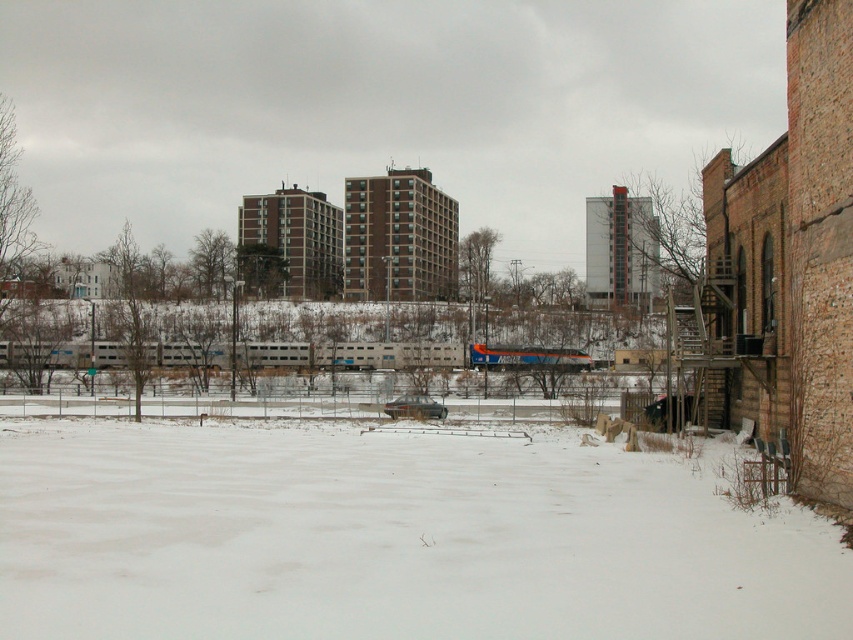
Question: Does white powdery snow at lower center appear under orange metallic train at center?

Choices:
 (A) no
 (B) yes

Answer: (B)

Question: Is silver metallic train at center thinner than orange metallic train at center?

Choices:
 (A) yes
 (B) no

Answer: (B)

Question: Does white powdery snow at lower center have a smaller size compared to silver metallic train at center?

Choices:
 (A) yes
 (B) no

Answer: (A)

Question: Which point appears closest to the camera in this image?

Choices:
 (A) (177, 618)
 (B) (554, 356)
 (C) (540, 364)

Answer: (A)

Question: Estimate the real-world distances between objects in this image. Which object is farther from the orange metallic train at center?

Choices:
 (A) silver metallic train at center
 (B) white powdery snow at lower center

Answer: (B)

Question: Which point appears farthest from the camera in this image?

Choices:
 (A) (541, 362)
 (B) (93, 365)
 (C) (461, 632)

Answer: (A)